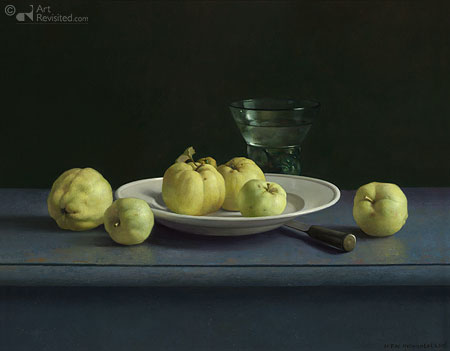
Find the location of `cup`. cup is located at coordinates (256, 117).